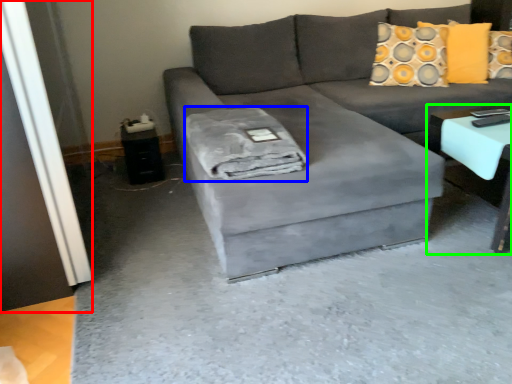
Question: Based on their relative distances, which object is farther from glass door (highlighted by a red box)? Choose from material (highlighted by a blue box) and table (highlighted by a green box).

Choices:
 (A) material
 (B) table

Answer: (B)